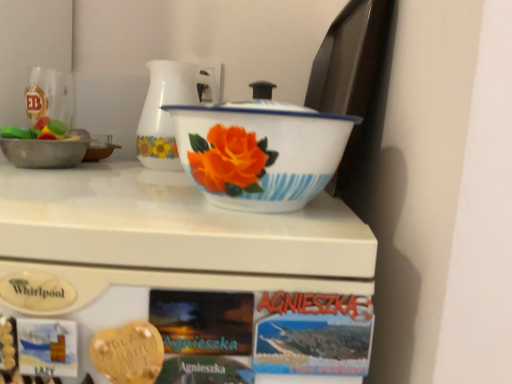
Where is `vacant space in front of white enamel basin at center`? The height and width of the screenshot is (384, 512). vacant space in front of white enamel basin at center is located at coordinates (234, 238).